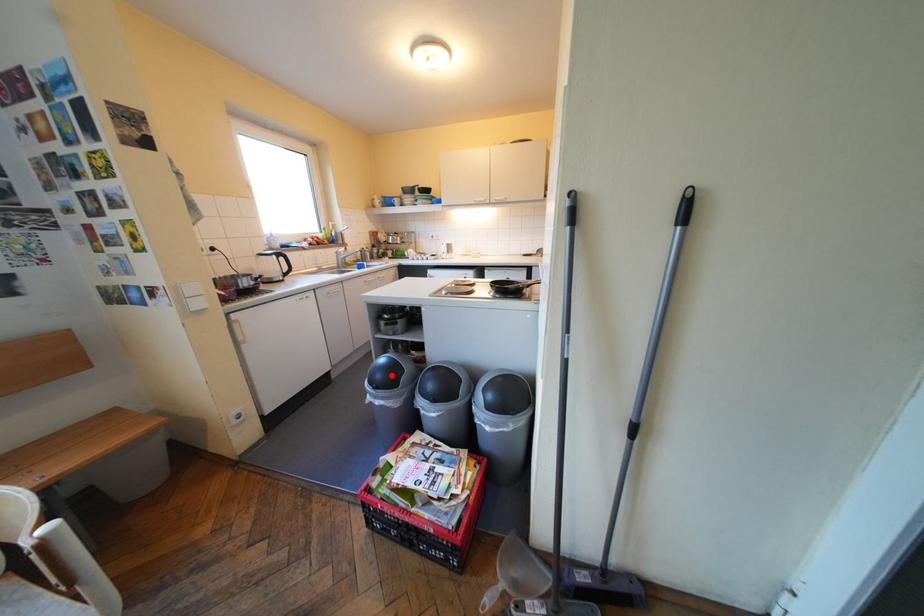
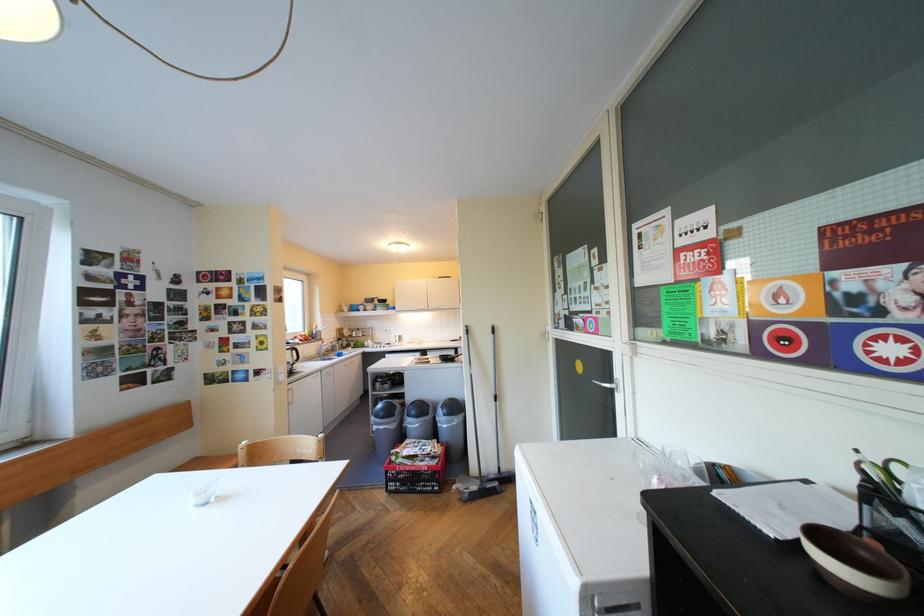
Question: A red point is marked in image1. In image2, is the corresponding 3D point closer to the camera or farther? Reply with the corresponding letter.

Choices:
 (A) The corresponding 3D point is closer.
 (B) The corresponding 3D point is farther.

Answer: (B)